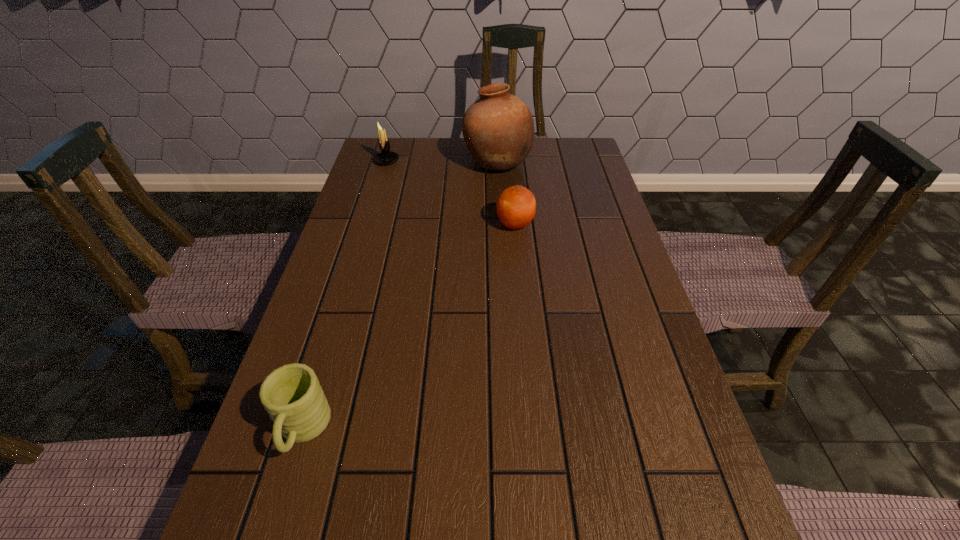
Choose which object is the second nearest neighbor to the candle holder. Please provide its 2D coordinates. Your answer should be formatted as a tuple, i.e. [(x, y)], where the tuple contains the x and y coordinates of a point satisfying the conditions above.

[(516, 206)]

Identify which object is the third nearest to the pottery. Please provide its 2D coordinates. Your answer should be formatted as a tuple, i.e. [(x, y)], where the tuple contains the x and y coordinates of a point satisfying the conditions above.

[(291, 394)]